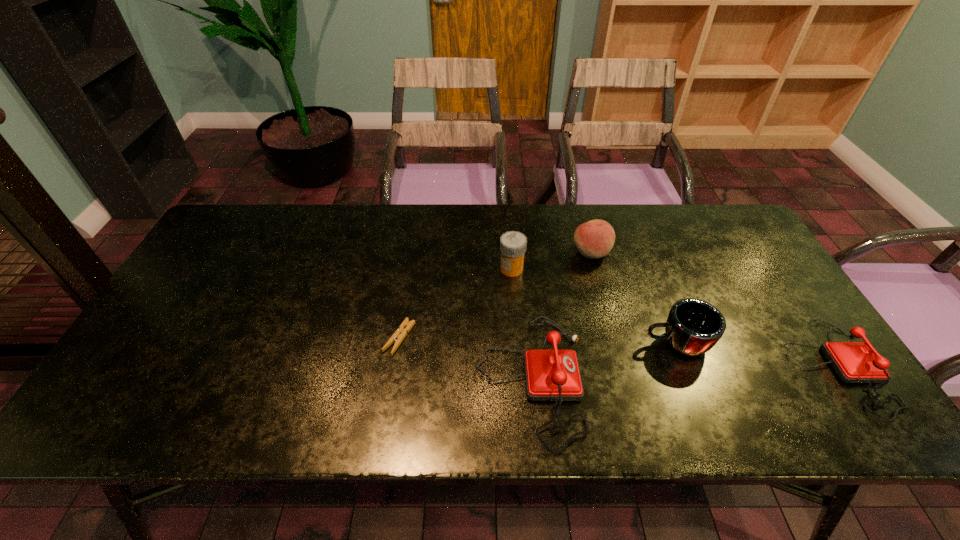
The width and height of the screenshot is (960, 540). Find the location of `the left telephone`. the left telephone is located at coordinates (550, 375).

The image size is (960, 540). I want to click on the second shortest object, so click(x=855, y=362).

At what (x,y) coordinates should I click in order to perform the action: click on the right telephone. Please return your answer as a coordinate pair (x, y). Looking at the image, I should click on (855, 362).

Find the location of a particular element. Image resolution: width=960 pixels, height=540 pixels. peach is located at coordinates (594, 239).

Locate an element on the screen. This screenshot has width=960, height=540. medicine is located at coordinates (513, 244).

The width and height of the screenshot is (960, 540). I want to click on the shortest object, so click(399, 335).

Locate an element on the screen. The image size is (960, 540). clothespin is located at coordinates (399, 335).

Identify the location of the fifth object from left to right. This screenshot has width=960, height=540. (693, 327).

At what (x,y) coordinates should I click in order to perform the action: click on vacant region located 0.120m on the dial of the taller telephone. Please return your answer as a coordinate pair (x, y). Image resolution: width=960 pixels, height=540 pixels. Looking at the image, I should click on (636, 379).

The width and height of the screenshot is (960, 540). Find the location of `vacant space situated on the right of the third object from right to left`. vacant space situated on the right of the third object from right to left is located at coordinates (712, 253).